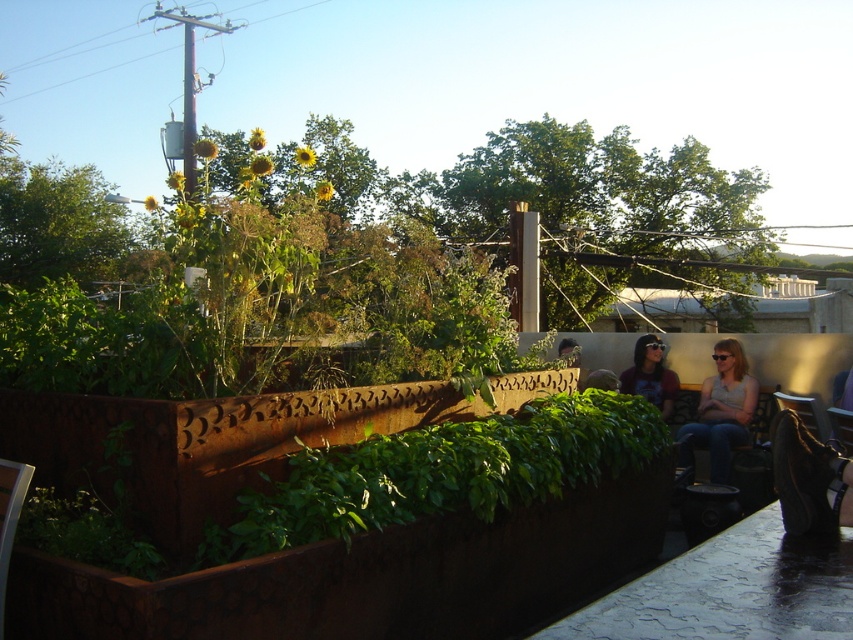
Is rusty metal planter at center positioned behind denim jeans at right?

No, it is in front of denim jeans at right.

Is rusty metal planter at center below denim jeans at right?

Actually, rusty metal planter at center is above denim jeans at right.

I want to click on rusty metal planter at center, so click(x=440, y=472).

Which of these two, rusty metal planter at center or matte brown shirt at center, stands taller?

matte brown shirt at center is taller.

Who is more distant from viewer, (279, 493) or (675, 381)?

Point (675, 381)

Describe the element at coordinates (440, 472) in the screenshot. This screenshot has width=853, height=640. I see `rusty metal planter at center` at that location.

I want to click on rusty metal planter at center, so click(440, 472).

Which is more to the left, denim jeans at right or matte brown shirt at center?

matte brown shirt at center is more to the left.

Which is in front, point (726, 346) or point (650, 397)?

Point (726, 346) is more forward.

You are a GUI agent. You are given a task and a screenshot of the screen. Output one action in this format:
    pyautogui.click(x=<x>, y=<y>)
    Task: Click on the denim jeans at right
    This screenshot has height=640, width=853.
    Given the screenshot: What is the action you would take?
    pyautogui.click(x=721, y=412)